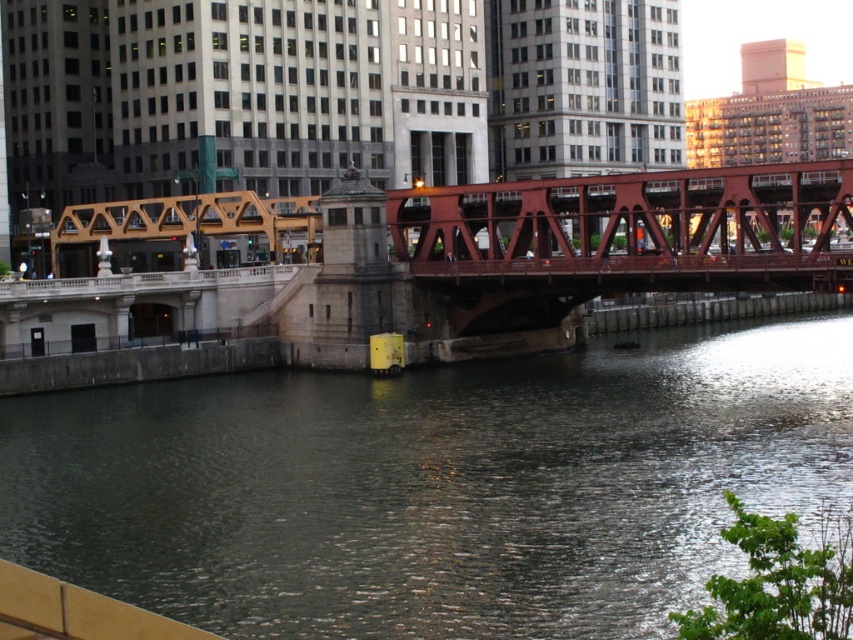
Is point (616, 518) less distant than point (672, 221)?

Yes.

This screenshot has height=640, width=853. What are the coordinates of `dark green water at center` in the screenshot? It's located at (434, 484).

Describe the element at coordinates (434, 484) in the screenshot. I see `dark green water at center` at that location.

I want to click on dark green water at center, so click(x=434, y=484).